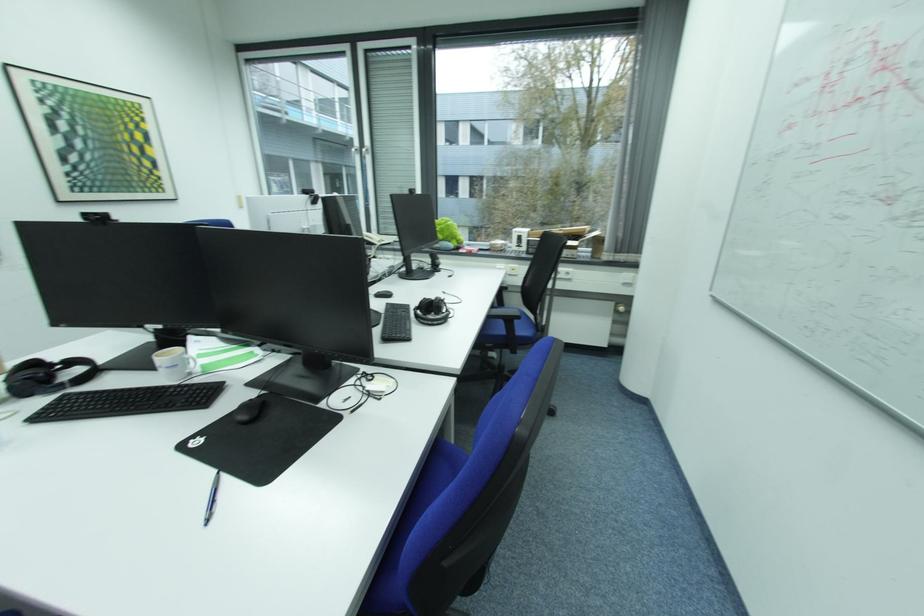
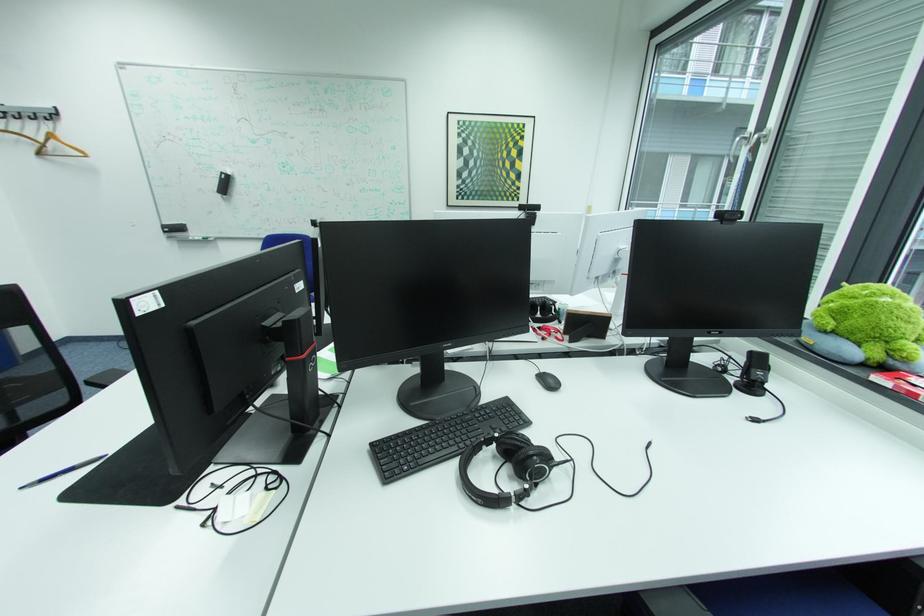
Where in the second image is the point corresponding to point 361,413 from the first image?

(187, 508)